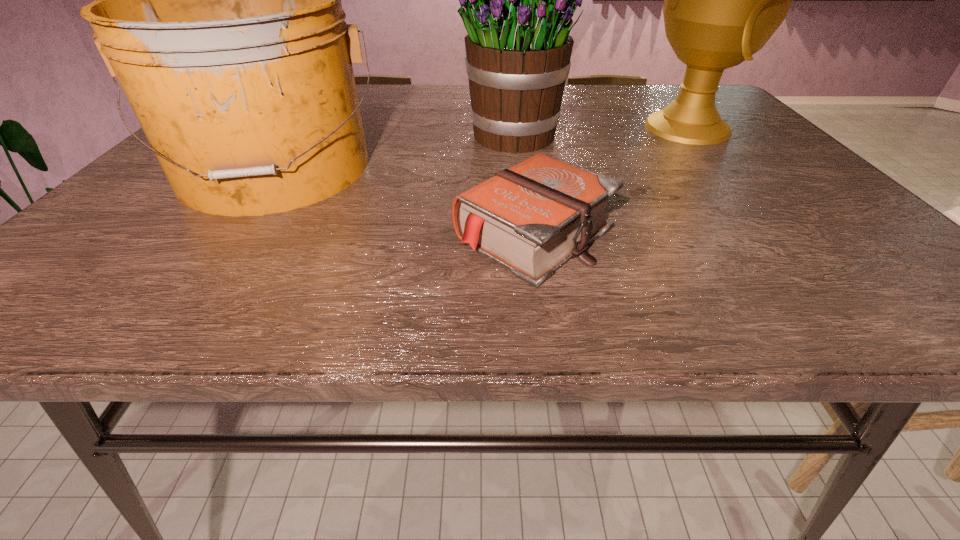
Find the location of `the rightmost object`. the rightmost object is located at coordinates (723, 0).

What are the coordinates of `the tallest object` in the screenshot? It's located at (723, 0).

Find the location of a particular element. bouquet is located at coordinates [518, 48].

Find the location of a particular element. bucket is located at coordinates (218, 8).

You are a GUI agent. You are given a task and a screenshot of the screen. Output one action in this format:
    pyautogui.click(x=<x>, y=<y>)
    Task: Click on the third tallest object
    
    Given the screenshot: What is the action you would take?
    pyautogui.click(x=218, y=8)

Locate an element on the screen. Bible is located at coordinates [531, 218].

Where is `vacant point located 0.360m on the engravings side of the trophy`? The width and height of the screenshot is (960, 540). vacant point located 0.360m on the engravings side of the trophy is located at coordinates (501, 127).

Identify the location of free space located on the engravings side of the trophy. The image size is (960, 540). (505, 127).

Where is `vacant space located 0.080m on the engravings side of the trophy`? This screenshot has height=540, width=960. vacant space located 0.080m on the engravings side of the trophy is located at coordinates (606, 127).

Locate an element on the screen. free spot located on the left of the bouquet is located at coordinates (352, 136).